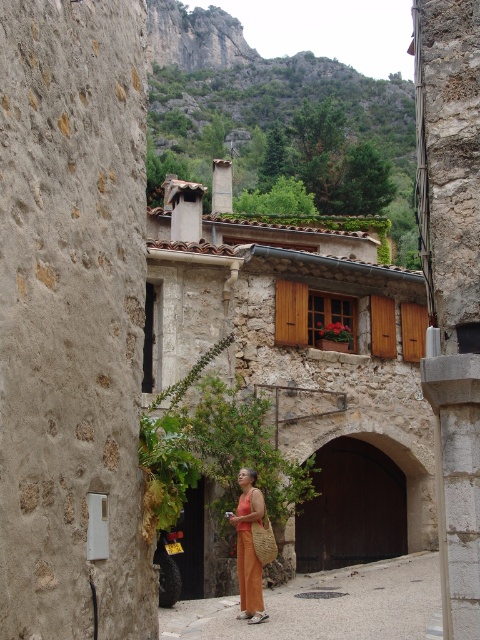
Consider the image. Does smooth stone alley at center have a greater width compared to orange woven bag at center?

Correct, the width of smooth stone alley at center exceeds that of orange woven bag at center.

Does smooth stone alley at center appear on the right side of orange woven bag at center?

Correct, you'll find smooth stone alley at center to the right of orange woven bag at center.

Identify the location of smooth stone alley at center. This screenshot has height=640, width=480. (326, 605).

Is stone textured building at center to the right of orange woven dress at center from the viewer's perspective?

Correct, you'll find stone textured building at center to the right of orange woven dress at center.

Does stone textured building at center have a greater width compared to orange woven dress at center?

Yes.

Locate an element on the screen. This screenshot has height=640, width=480. stone textured building at center is located at coordinates (303, 358).

Can you confirm if orange woven bag at center is shorter than orange woven dress at center?

Correct, orange woven bag at center is not as tall as orange woven dress at center.

Which is more to the left, orange woven bag at center or orange woven dress at center?

From the viewer's perspective, orange woven dress at center appears more on the left side.

Is point (240, 515) less distant than point (245, 544)?

No, it is not.

Image resolution: width=480 pixels, height=640 pixels. In order to click on orange woven bag at center in this screenshot , I will do `click(249, 547)`.